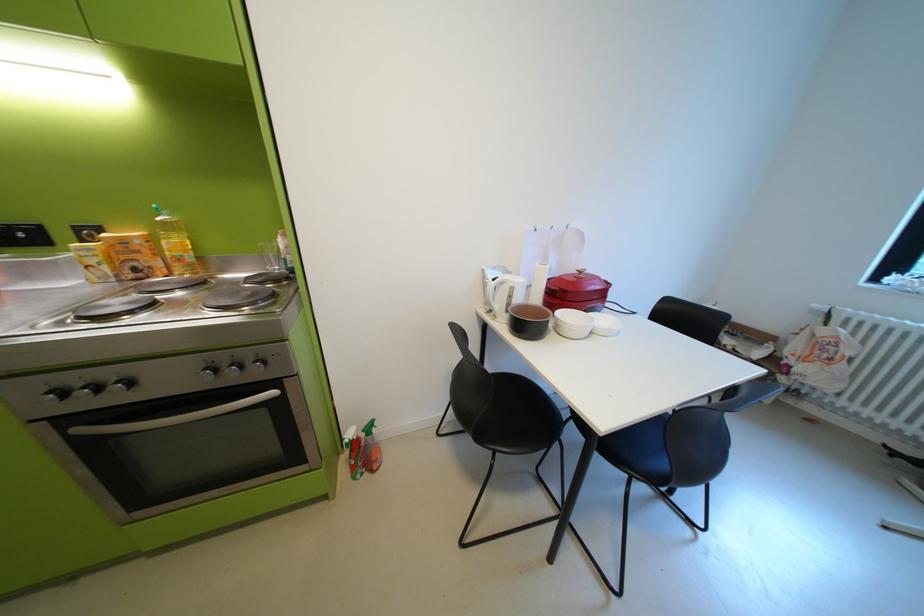
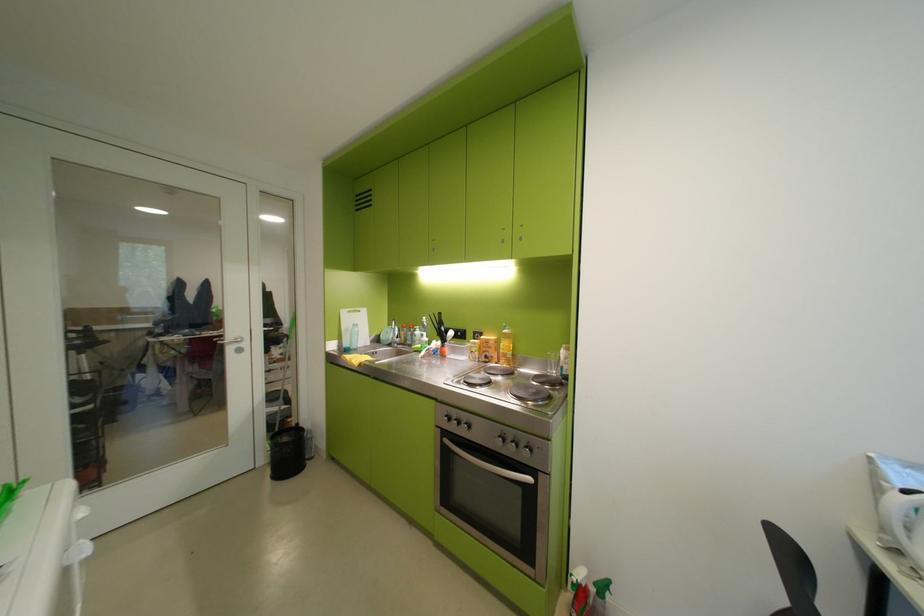
Question: How did the camera likely rotate?

Choices:
 (A) Left
 (B) Right
 (C) Up
 (D) Down

Answer: (A)